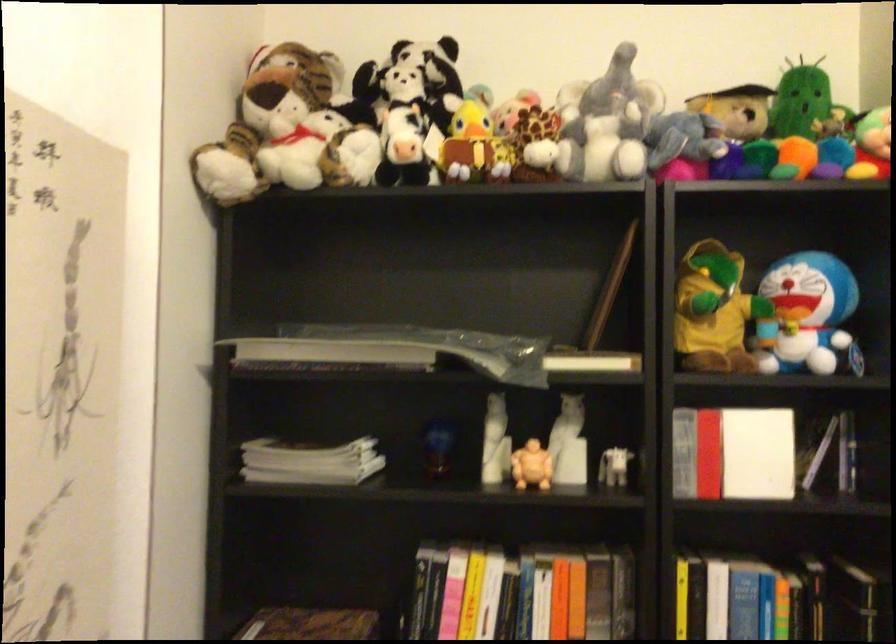
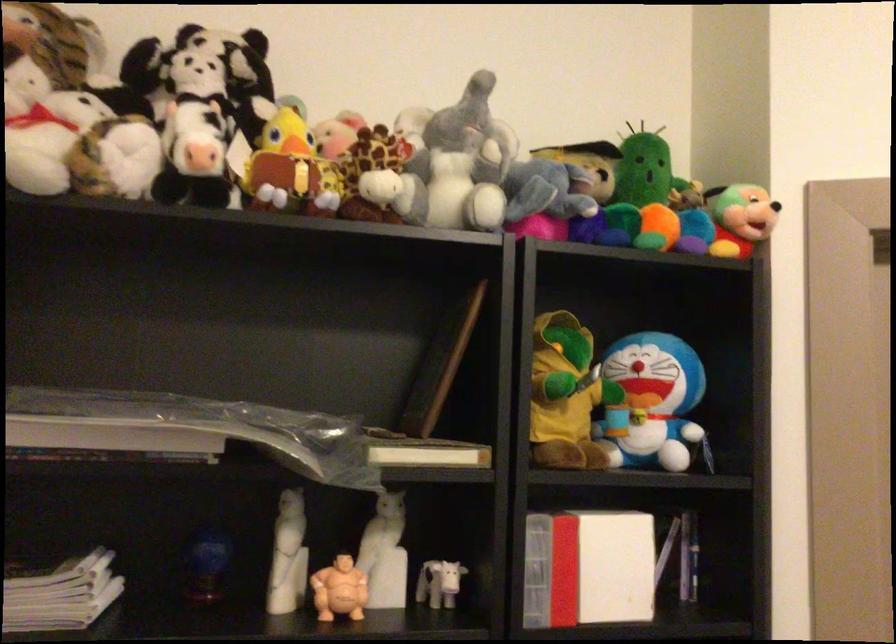
Question: Based on the continuous images, in which direction is the camera rotating? Reply with the corresponding letter.

Choices:
 (A) Left
 (B) Right
 (C) Up
 (D) Down

Answer: (B)